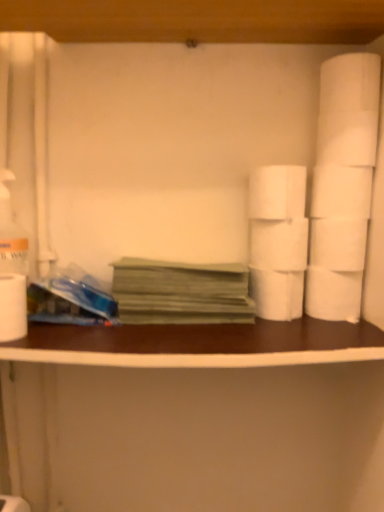
Locate an element on the screen. Image resolution: width=384 pixels, height=512 pixels. empty space that is in between white matte toilet paper at left, which is the 8th toilet paper in right-to-left order, and white matte toilet paper at center, the 3th toilet paper positioned from the left is located at coordinates (139, 328).